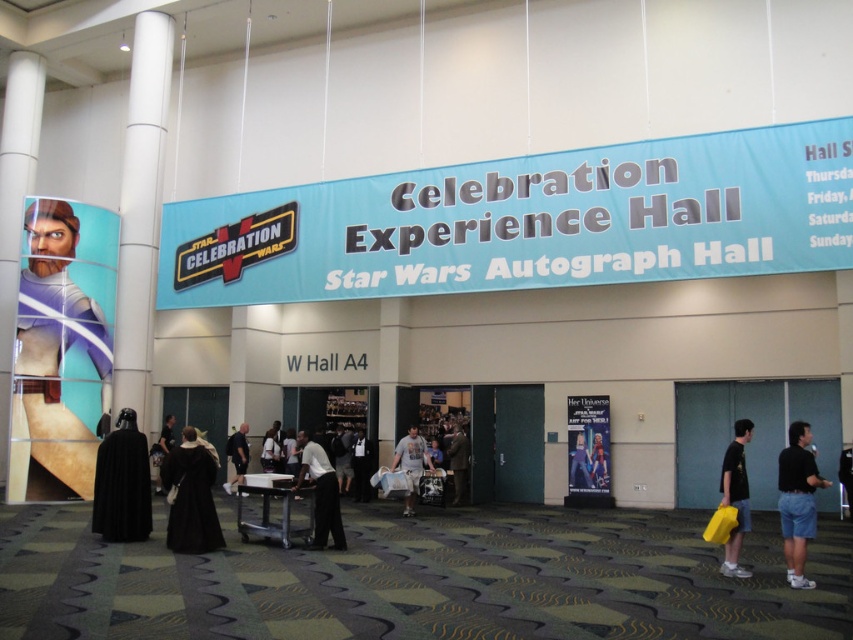
You are a Star Wars fan standing at the entrance of the Celebration Experience Hall. You see a metallic silver poster at center and a dark brown leather jacket at center. Can you walk directly from one to the other without moving around any obstacles?

The metallic silver poster at center and dark brown leather jacket at center are 3.65 meters apart from each other, so yes, you can walk directly between them without any obstacles since they are positioned at the center and the distance is clear.

You are standing at the entrance of the Celebration Experience Hall and Star Wars Autograph Hall in W Hall A4. You see two points marked on the floor. One is at point (x=590, y=420) and the other at point (x=349, y=451). Which point is closer to you?

Point (x=590, y=420) is in front of point (x=349, y=451), so it is closer to you.

In the scene shown: You are planning to take a photo of the metallic silver poster at center and the dark brown leather jacket at center for a social media post. Since you want both items to be clearly visible in the frame, which object should you focus on to ensure it fits properly?

You should focus on the metallic silver poster at center because its width is larger than the dark brown leather jacket at center, so ensuring the poster fits will automatically include the jacket in the frame.